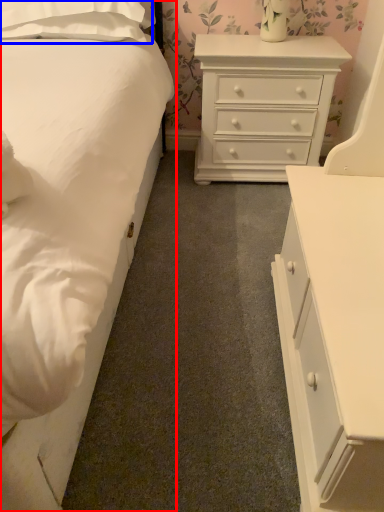
Question: Which of the following is the farthest to the observer, bed (highlighted by a red box) or pillow (highlighted by a blue box)?

Choices:
 (A) bed
 (B) pillow

Answer: (B)